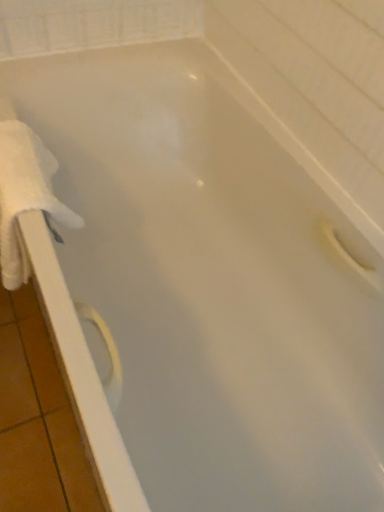
What do you see at coordinates (25, 196) in the screenshot?
I see `white fluffy towel at left` at bounding box center [25, 196].

Where is `white fluffy towel at left`? white fluffy towel at left is located at coordinates (25, 196).

Measure the distance between white fluffy towel at left and camera.

The depth of white fluffy towel at left is 32.38 inches.

Locate an element on the screen. The image size is (384, 512). white fluffy towel at left is located at coordinates (25, 196).